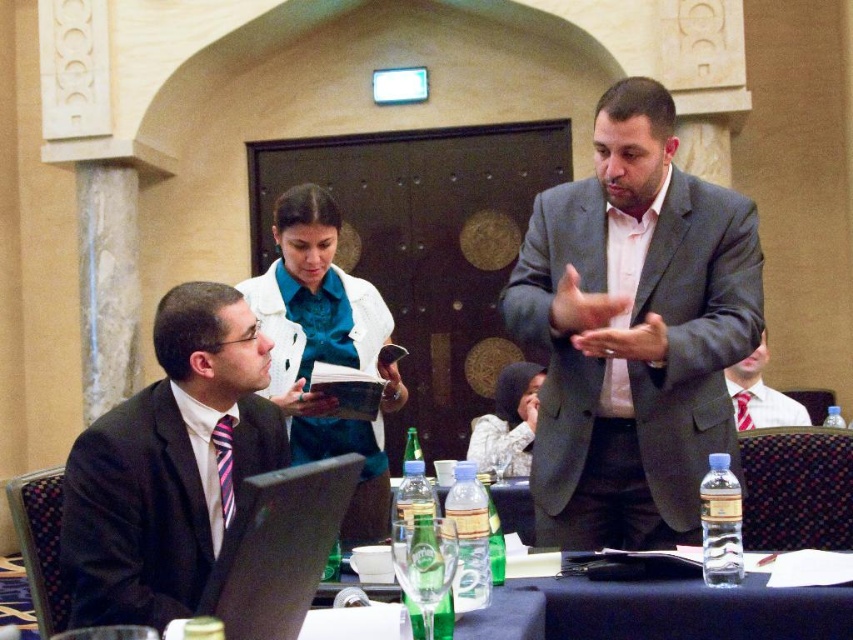
You are a photographer in the room and want to take a photo of the man in the dark suit at left. You notice a point at coordinates [169,465]. Where is this point located on the man?

The point at coordinates [169,465] is on the matte black suit at left.

You are standing at the entrance of the hall and want to hand a document to the person wearing the matte black suit at left and the person wearing the white textured hijab at center. If you can only walk 10 feet before needing to rest, can you reach both individuals without resting?

The matte black suit at left is 10.12 feet away from the white textured hijab at center. Since the distance between them is slightly over 10 feet, you would need to rest after reaching one before proceeding to the other.

In the scene shown: You are a photographer standing at the camera position. You want to take a closeup photo of the matte black suit at left without moving the camera. Is it possible to do so?

The matte black suit at left is 2.40 meters away from the camera, so yes, it is possible to take a closeup photo without moving the camera as the distance is within a typical zoom range.